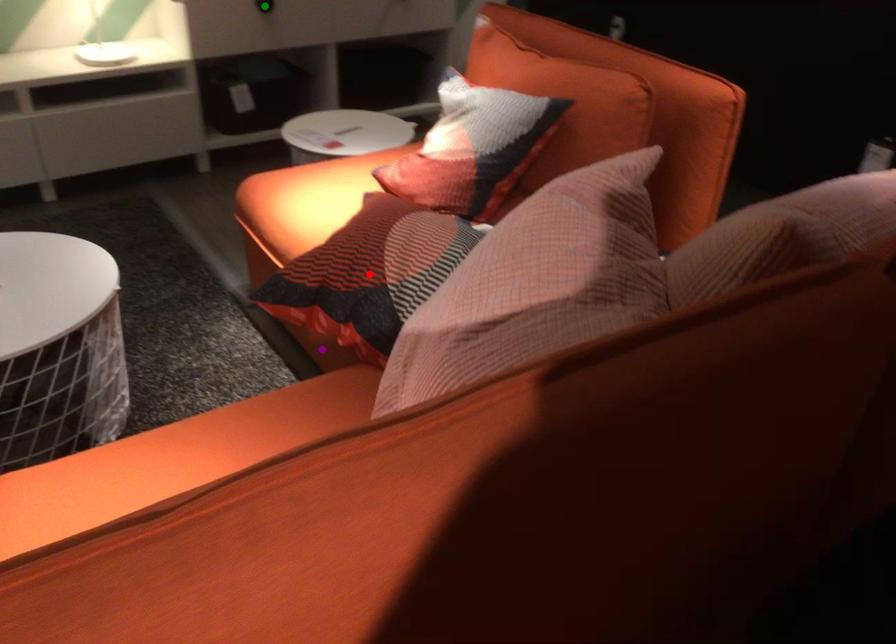
Order these from nearest to farthest:
red point | purple point | green point

green point, purple point, red point